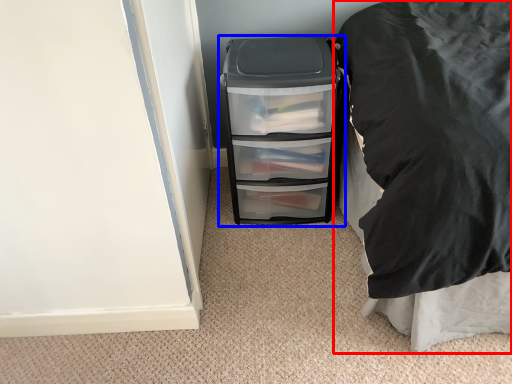
Question: Which of the following is the closest to the observer, furniture (highlighted by a red box) or file cabinet (highlighted by a blue box)?

Choices:
 (A) furniture
 (B) file cabinet

Answer: (A)